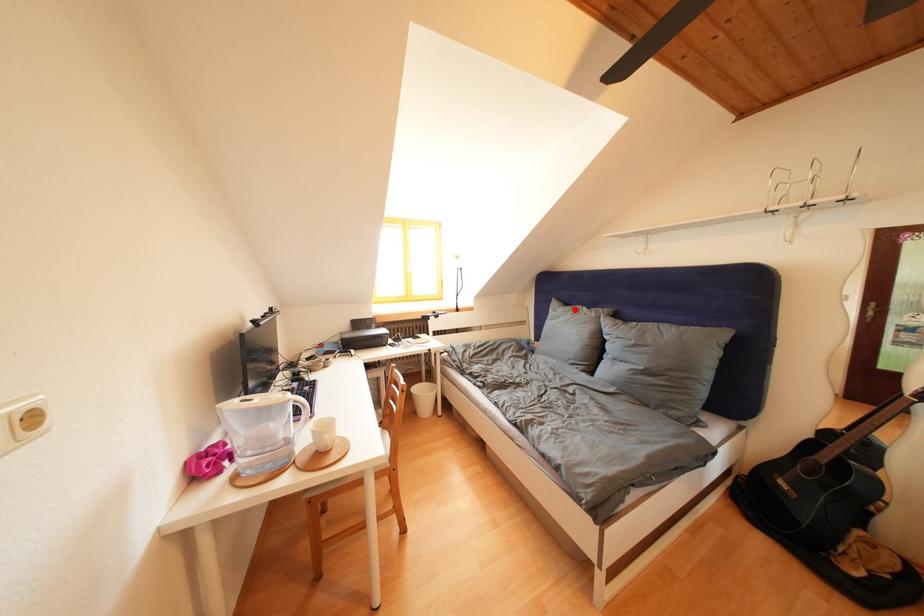
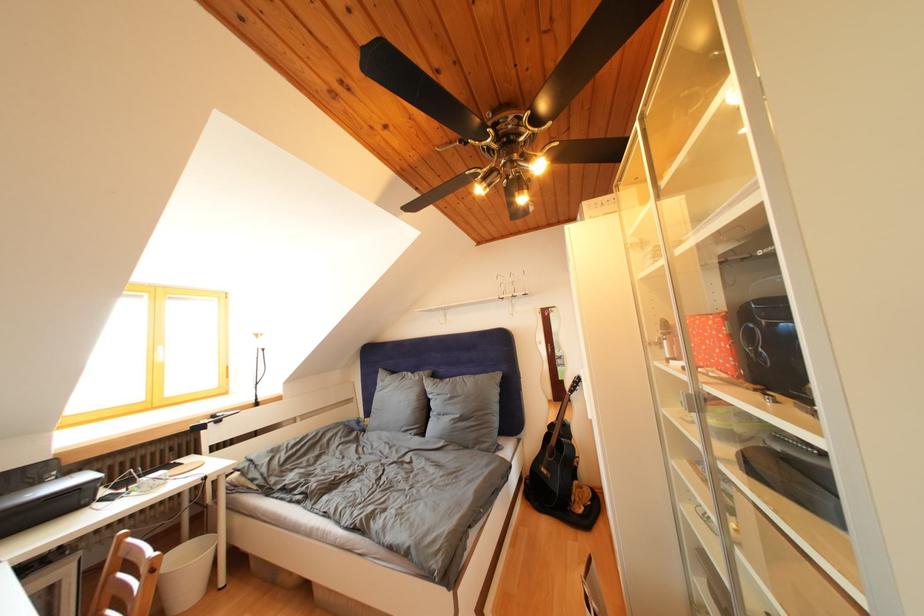
In the second image, find the point that corresponds to the highlighted location in the first image.

(400, 378)